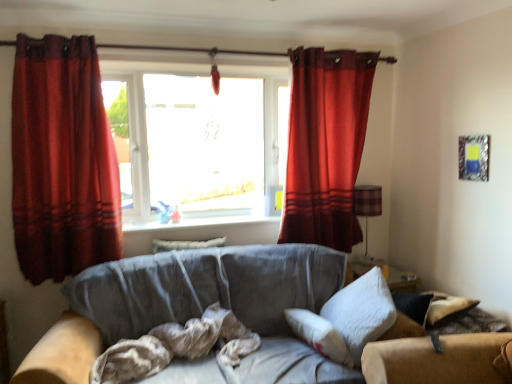
Question: Is transparent glass window at center positioned in front of suede gray couch at center?

Choices:
 (A) yes
 (B) no

Answer: (B)

Question: Is the surface of transparent glass window at center in direct contact with suede gray couch at center?

Choices:
 (A) yes
 (B) no

Answer: (B)

Question: Are transparent glass window at center and suede gray couch at center located far from each other?

Choices:
 (A) no
 (B) yes

Answer: (A)

Question: Could you tell me if transparent glass window at center is turned towards suede gray couch at center?

Choices:
 (A) no
 (B) yes

Answer: (A)

Question: Is transparent glass window at center positioned beyond the bounds of suede gray couch at center?

Choices:
 (A) yes
 (B) no

Answer: (A)

Question: Can you confirm if transparent glass window at center is wider than suede gray couch at center?

Choices:
 (A) yes
 (B) no

Answer: (B)

Question: Does brown textured fabric at center turn towards white fluffy pillow at right, positioned as the 2th pillow in back-to-front order?

Choices:
 (A) no
 (B) yes

Answer: (A)

Question: From a real-world perspective, is brown textured fabric at center physically below white fluffy pillow at right, placed as the first pillow when sorted from right to left?

Choices:
 (A) no
 (B) yes

Answer: (B)

Question: Is brown textured fabric at center oriented away from white fluffy pillow at right, which appears as the first pillow when viewed from the front?

Choices:
 (A) yes
 (B) no

Answer: (B)

Question: Is brown textured fabric at center with white fluffy pillow at right, which appears as the first pillow when viewed from the front?

Choices:
 (A) no
 (B) yes

Answer: (A)

Question: Is brown textured fabric at center bigger than white fluffy pillow at right, placed as the first pillow when sorted from right to left?

Choices:
 (A) yes
 (B) no

Answer: (B)

Question: Considering the relative sizes of brown textured fabric at center and white fluffy pillow at right, which appears as the first pillow when viewed from the front, in the image provided, is brown textured fabric at center wider than white fluffy pillow at right, which appears as the first pillow when viewed from the front,?

Choices:
 (A) no
 (B) yes

Answer: (B)

Question: Is metallic silver picture frame at upper right oriented towards velvet-like beige pillow at center, the 2th pillow in the right-to-left sequence?

Choices:
 (A) no
 (B) yes

Answer: (A)